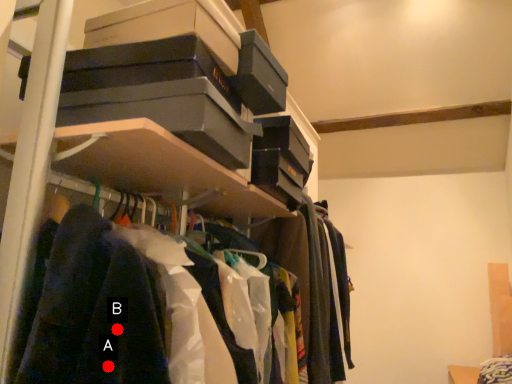
Question: Two points are circled on the image, labeled by A and B beside each circle. Which point is closer to the camera taking this photo?

Choices:
 (A) A is closer
 (B) B is closer

Answer: (A)